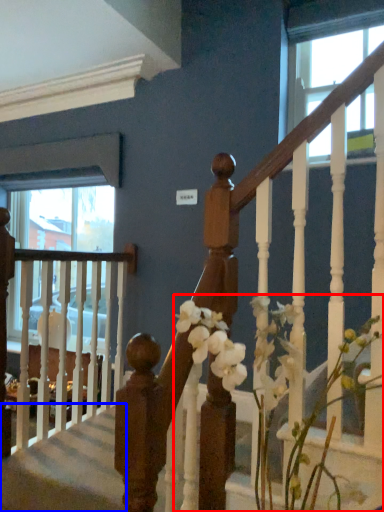
Question: Which object appears closest to the camera in this image, floral arrangement (highlighted by a red box) or stairwell (highlighted by a blue box)?

Choices:
 (A) floral arrangement
 (B) stairwell

Answer: (A)